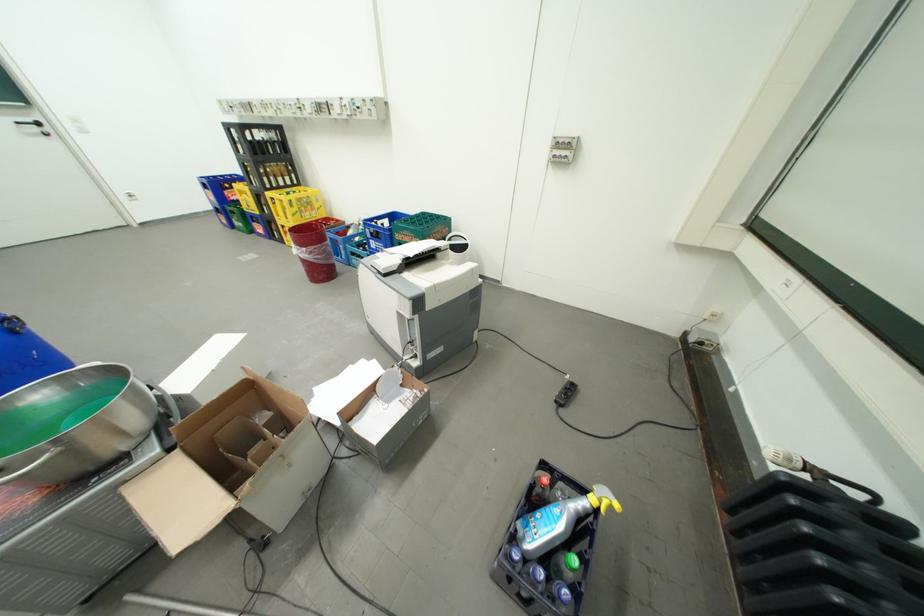
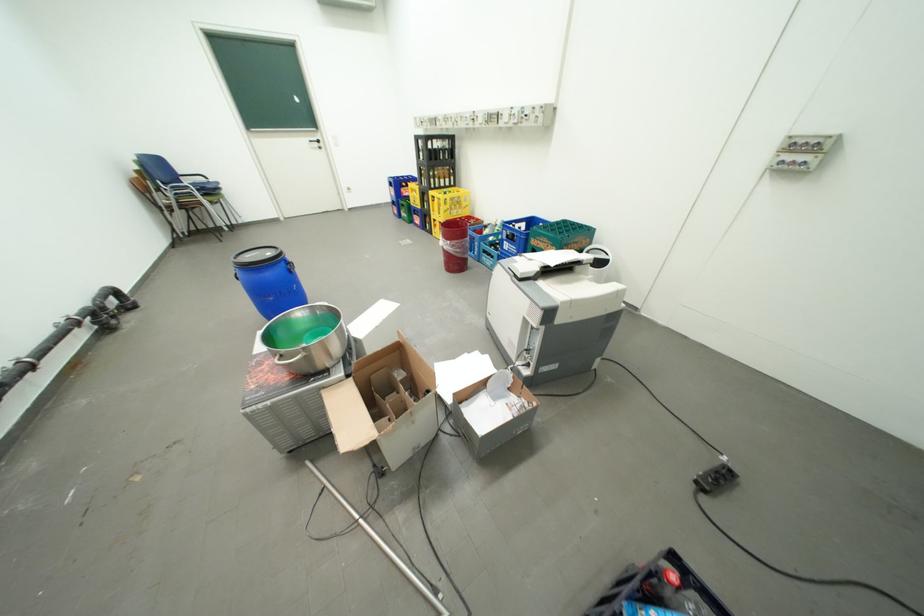
Find the pixel in the second image that matches point 381,241 in the first image.

(516, 244)